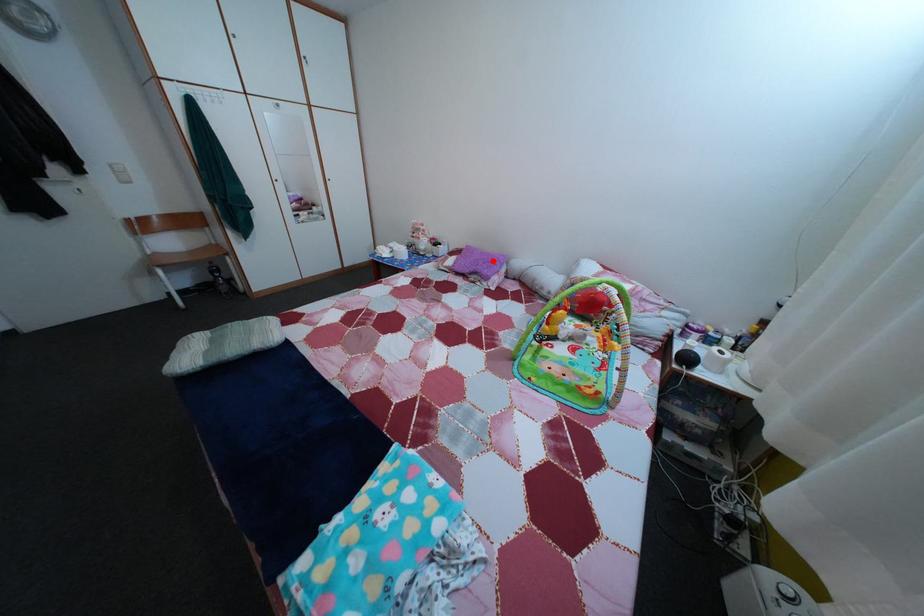
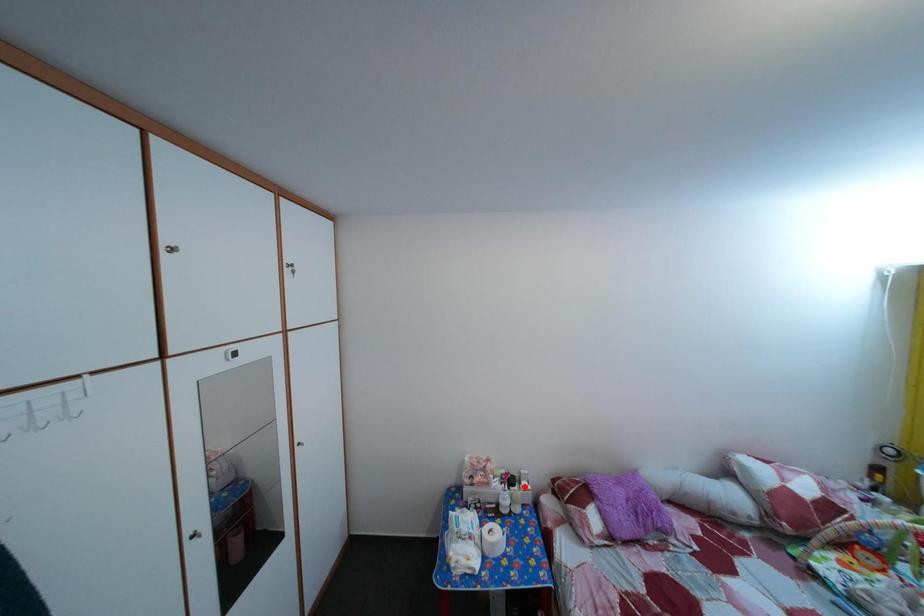
I am providing you with two images of the same scene from different viewpoints. A red point is marked on the first image and another point is marked on the second image. Do the highlighted points in image1 and image2 indicate the same real-world spot?

No